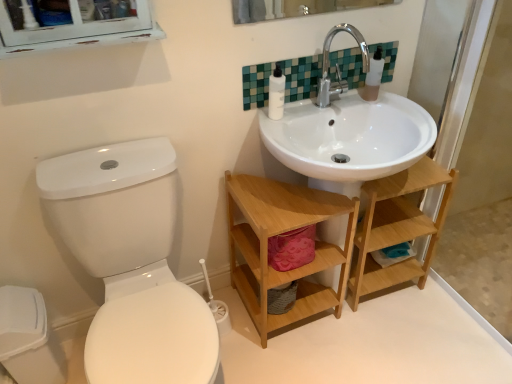
Locate an element on the screen. The height and width of the screenshot is (384, 512). free space to the right of white plastic bottle at upper center is located at coordinates (306, 110).